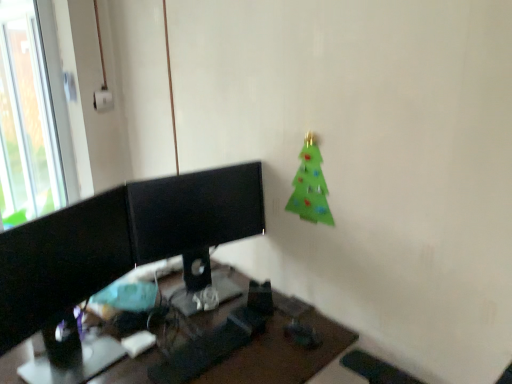
Find the location of a particular element. vacant space to the right of black glossy monitor at center is located at coordinates pos(280,315).